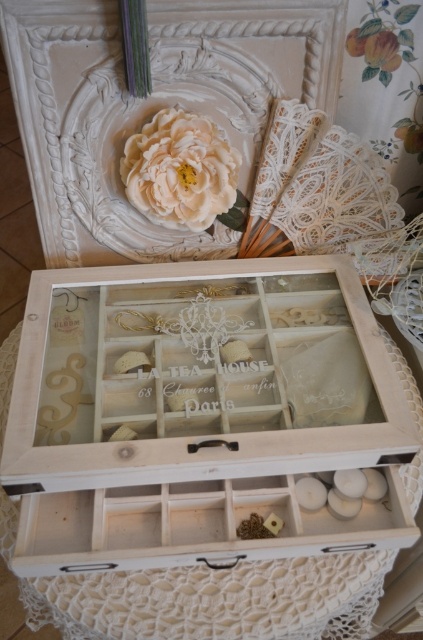
You are organizing a tea party and need to place a rectangular tray that is 12 inches long into the white wood box at center or the white wood drawer at center. Based on their sizes, which one can fit the tray?

The white wood box at center might be wider than the white wood drawer at center, so the tray would likely fit better in the white wood box at center if its width accommodates the tray.

You are organizing items in a vintage tea box. You need to place a new tea bag in the white wood drawer at center and a decorative flower in the creamy matte flower at upper center. Which object should you access first to place the tea bag?

The white wood drawer at center is in front of creamy matte flower at upper center, so you should access the white wood drawer at center first to place the tea bag since it is closer to you.

You have a small decorative item that needs to be placed inside the white wood box at center or the white wood drawer at center. Based on their sizes, which one can accommodate the item more comfortably?

The white wood box at center is bigger than the white wood drawer at center, so the item can be placed more comfortably in the white wood box at center.